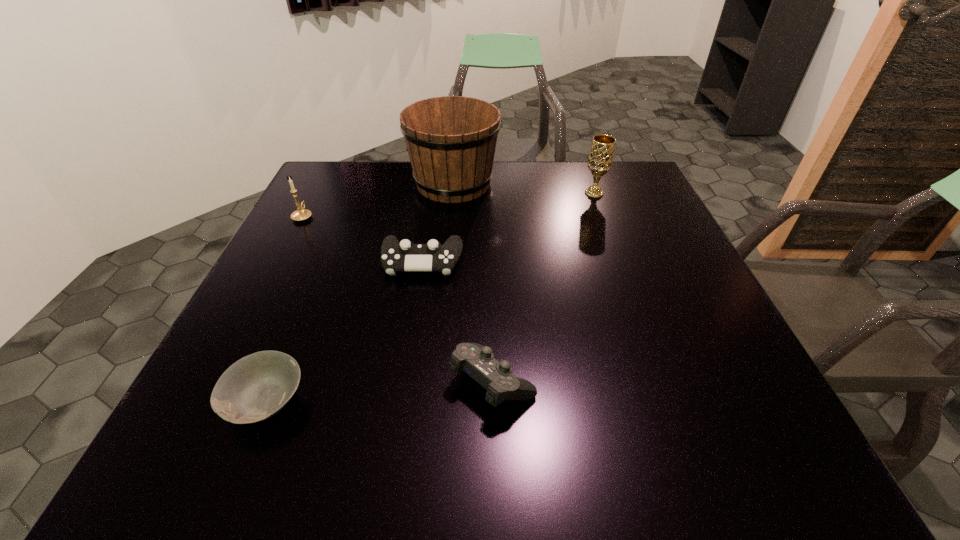
Image resolution: width=960 pixels, height=540 pixels. Identify the location of unoccupied position between the second object from left to right and the third farthest object. (284, 309).

The image size is (960, 540). Identify the location of free space between the tallest object and the candle holder. (378, 200).

What are the coordinates of `free area in between the tallest object and the candle holder` in the screenshot? It's located at (378, 200).

The image size is (960, 540). I want to click on vacant space that is in between the leftmost object and the fifth object from right to left, so click(x=284, y=309).

Where is `empty space that is in between the candle holder and the fourth farthest object`? The image size is (960, 540). empty space that is in between the candle holder and the fourth farthest object is located at coordinates (362, 239).

In order to click on free space between the second tallest object and the nearer control in this screenshot , I will do `click(543, 288)`.

Where is `free area in between the nearer control and the leftmost object`? free area in between the nearer control and the leftmost object is located at coordinates (397, 299).

The height and width of the screenshot is (540, 960). I want to click on blank region between the farther control and the fifth shortest object, so click(x=508, y=228).

The image size is (960, 540). I want to click on free point between the tallest object and the third nearest object, so click(x=438, y=222).

Locate an element on the screen. the fourth closest object to the nearer control is located at coordinates (600, 159).